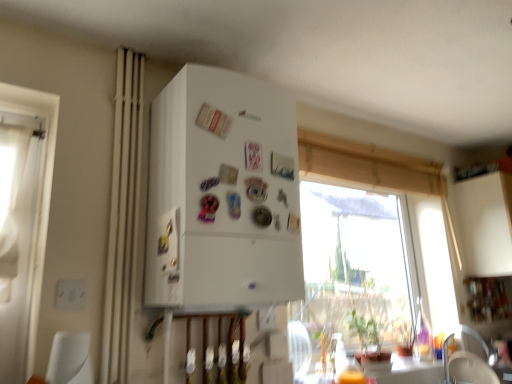
Question: In the image, is white matte refrigerator at center positioned in front of or behind transparent glass window at upper center?

Choices:
 (A) front
 (B) behind

Answer: (A)

Question: Looking at the image, does white matte refrigerator at center seem bigger or smaller compared to transparent glass window at upper center?

Choices:
 (A) big
 (B) small

Answer: (A)

Question: Based on their relative distances, which object is farther from the white fabric armchair at lower right?

Choices:
 (A) transparent glass window at upper center
 (B) beige fabric curtain at left
 (C) white matte refrigerator at center

Answer: (B)

Question: Which object is the closest to the beige fabric curtain at left?

Choices:
 (A) white matte refrigerator at center
 (B) white fabric armchair at lower right
 (C) transparent glass window at upper center

Answer: (A)